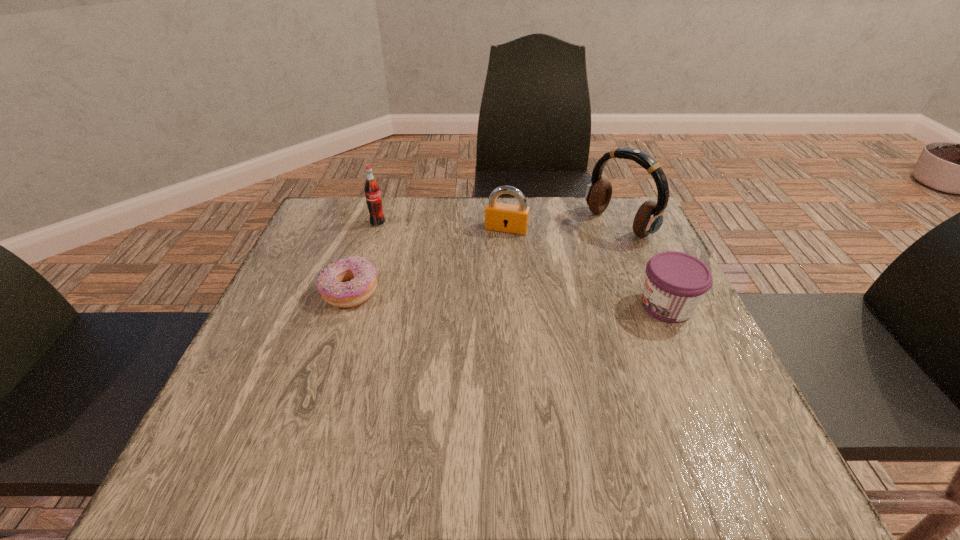
You are a GUI agent. You are given a task and a screenshot of the screen. Output one action in this format:
    pyautogui.click(x=<x>, y=<y>)
    Task: Click on the padlock situated at the far edge
    The width and height of the screenshot is (960, 540).
    Given the screenshot: What is the action you would take?
    pyautogui.click(x=502, y=217)

Locate an element on the screen. headset that is at the far edge is located at coordinates (649, 218).

Identify the location of doughnut present at the left edge. (350, 281).

Identify the location of soda bottle positioned at the left edge. Image resolution: width=960 pixels, height=540 pixels. (372, 190).

What are the coordinates of `jam that is at the right edge` in the screenshot? It's located at [x=675, y=282].

At what (x,y) coordinates should I click in order to perform the action: click on headset positioned at the right edge. Please return your answer as a coordinate pair (x, y). Looking at the image, I should click on (649, 218).

The width and height of the screenshot is (960, 540). In order to click on object at the far left corner in this screenshot , I will do pos(372,190).

This screenshot has height=540, width=960. I want to click on object present at the far right corner, so coord(649,218).

Locate an element on the screen. This screenshot has height=540, width=960. free space at the far edge of the desktop is located at coordinates (425, 233).

Where is `vacant space at the near edge of the desktop`? The width and height of the screenshot is (960, 540). vacant space at the near edge of the desktop is located at coordinates (645, 410).